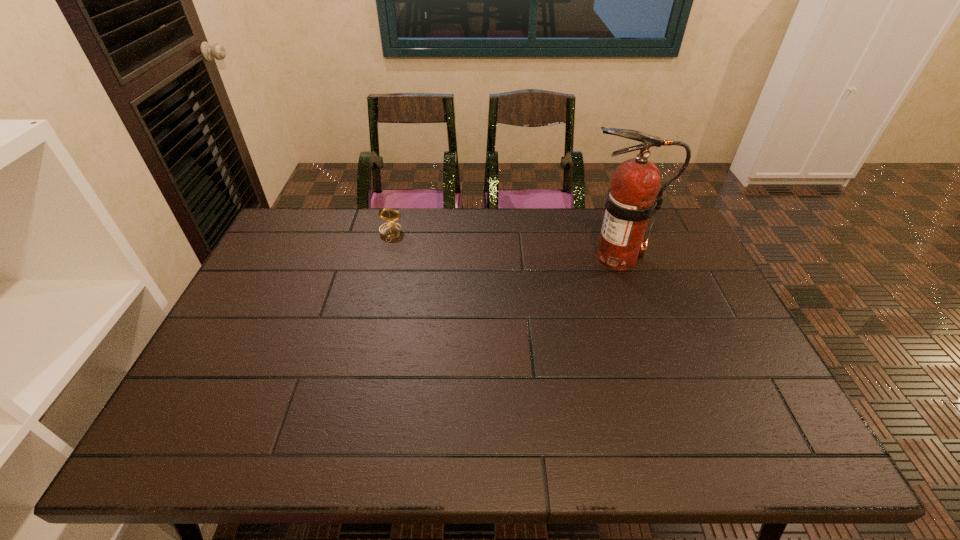
You are a GUI agent. You are given a task and a screenshot of the screen. Output one action in this format:
    pyautogui.click(x=<x>, y=<y>)
    Task: Click on the taller object
    
    Given the screenshot: What is the action you would take?
    pyautogui.click(x=632, y=200)

Image resolution: width=960 pixels, height=540 pixels. I want to click on the right object, so click(x=632, y=200).

The image size is (960, 540). What are the coordinates of `compass` in the screenshot? It's located at (391, 230).

Image resolution: width=960 pixels, height=540 pixels. I want to click on the left object, so click(x=391, y=230).

This screenshot has width=960, height=540. In order to click on vacant space located 0.100m at the nozzle of the fire extinguisher in this screenshot , I will do `click(546, 258)`.

Find the location of `vacant position located 0.260m at the nozzle of the fire extinguisher`. vacant position located 0.260m at the nozzle of the fire extinguisher is located at coordinates (496, 258).

At what (x,y) coordinates should I click in order to perform the action: click on vacant space located at the nozzle of the fire extinguisher. Please return your answer as a coordinate pair (x, y). The image size is (960, 540). Looking at the image, I should click on (552, 258).

The height and width of the screenshot is (540, 960). Identify the location of vacant space located 0.130m with the dial facing the left object. (382, 268).

Where is `fire extinguisher present at the far edge`? fire extinguisher present at the far edge is located at coordinates (632, 200).

Locate an element on the screen. The height and width of the screenshot is (540, 960). compass located at the far edge is located at coordinates tap(391, 230).